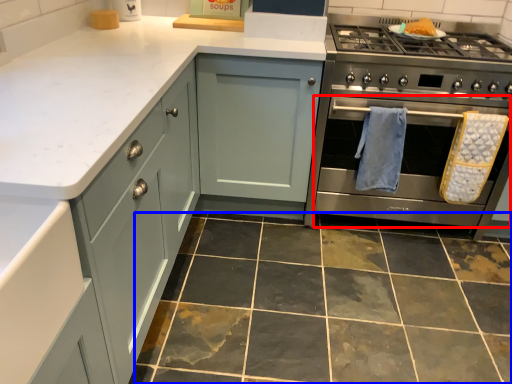
Question: Which of the following is the farthest to the observer, oven (highlighted by a red box) or ceramic tile (highlighted by a blue box)?

Choices:
 (A) oven
 (B) ceramic tile

Answer: (A)